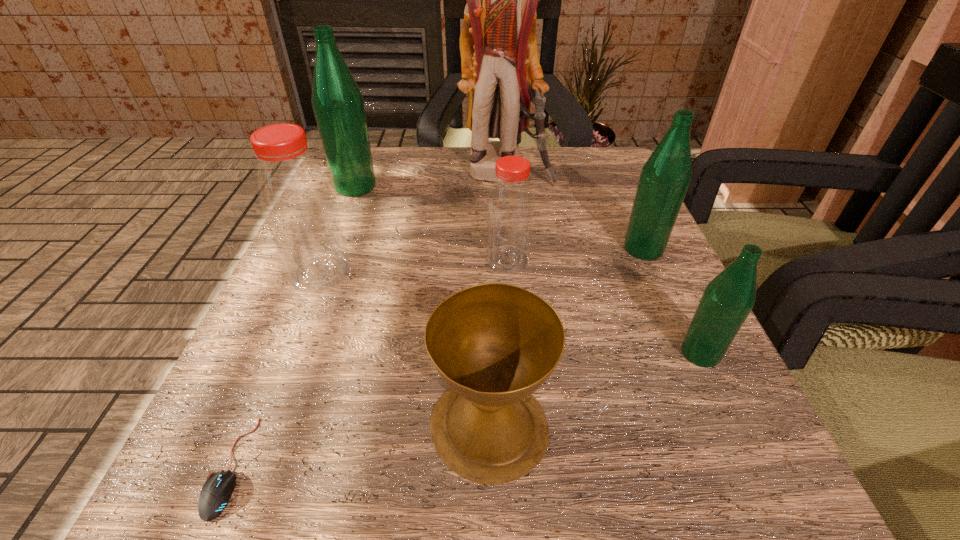
I want to click on vacant area that lies between the leftmost green bottle and the black mouse, so point(293,326).

At what (x,y) coordinates should I click in order to perform the action: click on empty location between the right red bottle and the second biggest green bottle. Please return your answer as a coordinate pair (x, y). This screenshot has width=960, height=540. Looking at the image, I should click on (576, 254).

This screenshot has height=540, width=960. What are the coordinates of `empty space between the second biggest green bottle and the bigger red bottle` in the screenshot? It's located at (482, 261).

The image size is (960, 540). I want to click on empty space between the right red bottle and the mouse, so click(369, 363).

Where is `vacant space that is in between the smaller red bottle and the second biggest green bottle`? Image resolution: width=960 pixels, height=540 pixels. vacant space that is in between the smaller red bottle and the second biggest green bottle is located at coordinates (576, 254).

You are a GUI agent. You are given a task and a screenshot of the screen. Output one action in this format:
    pyautogui.click(x=<x>, y=<y>)
    Task: Click on the seventh closest object to the second tallest object
    The image size is (960, 540).
    Given the screenshot: What is the action you would take?
    pyautogui.click(x=727, y=300)

You are a GUI agent. You are given a task and a screenshot of the screen. Output one action in this format:
    pyautogui.click(x=<x>, y=<y>)
    Task: Click on the object that is the sixth nearest to the second biggest green bottle
    This screenshot has width=960, height=540.
    Given the screenshot: What is the action you would take?
    pyautogui.click(x=338, y=104)

The height and width of the screenshot is (540, 960). I want to click on bottle object that ranks as the third closest to the bigger red bottle, so click(x=665, y=177).

I want to click on bottle that is the closest to the bigger red bottle, so [x=338, y=104].

In order to click on green bottle that is the closest to the second biggest green bottle in this screenshot , I will do `click(727, 300)`.